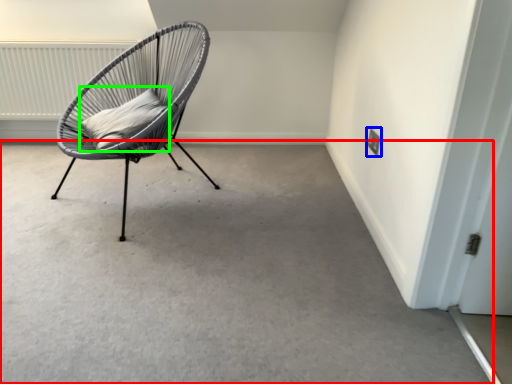
Question: Considering the real-world distances, which object is farthest from concrete (highlighted by a red box)? electric outlet (highlighted by a blue box) or pillow (highlighted by a green box)?

Choices:
 (A) electric outlet
 (B) pillow

Answer: (A)